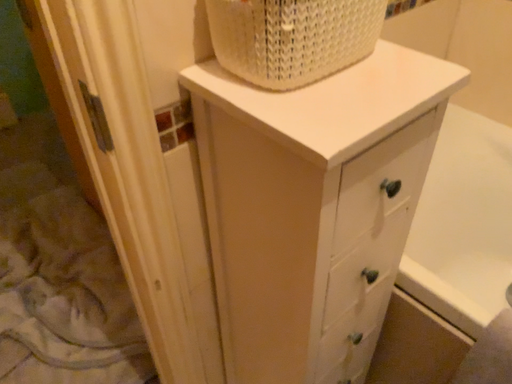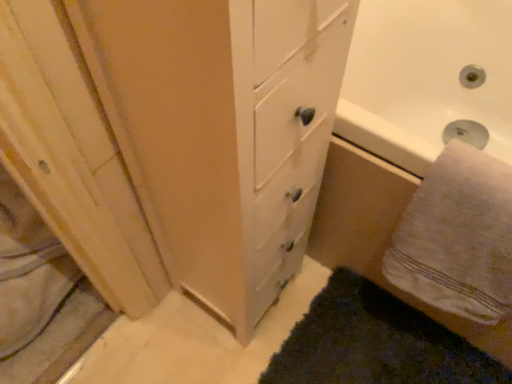
Question: Which way did the camera rotate in the video?

Choices:
 (A) rotated left
 (B) rotated right

Answer: (B)